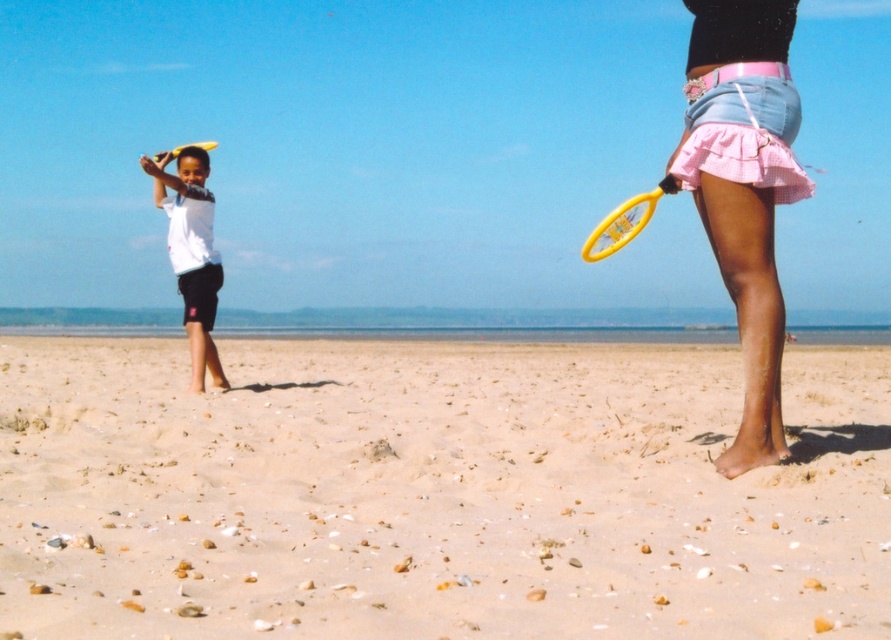
In the scene shown: You are standing on the beach and see two points marked on the sand. One is at point (627, 237) and the other at point (162, 150). Which point is closer to you?

Point (627, 237) is closer to the viewer than point (162, 150).

You are a photographer standing at the beach scene. You want to capture a photo of the pink denim skirt at right and the yellow plastic tennis racket at right in the same frame. Can you position yourself so that both objects are within your camera view? Explain your reasoning.

The pink denim skirt at right and yellow plastic tennis racket at right are 7.36 meters apart. Since 7.36 meters is a relatively large distance, the photographer may need to adjust their position or use a wide angle lens to ensure both objects fit within the camera view.